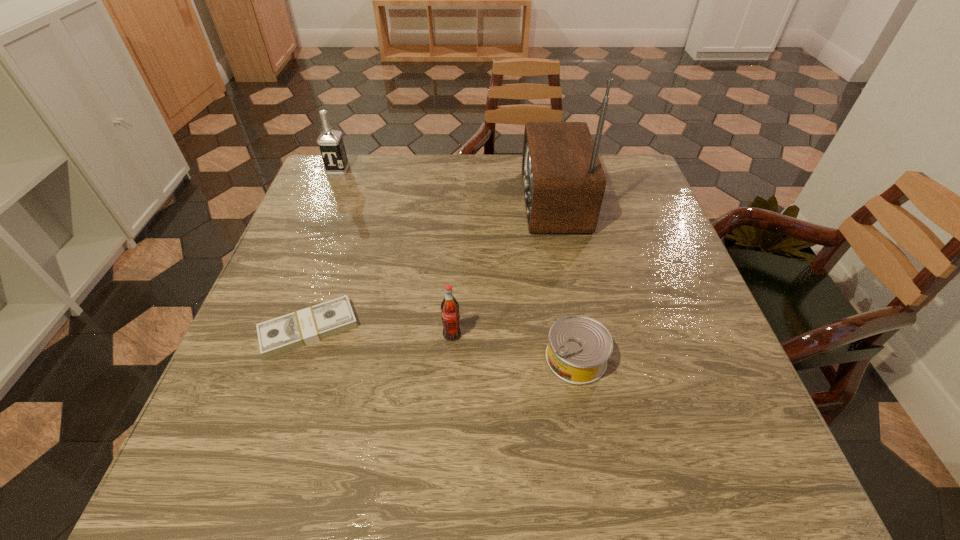
Locate an element on the screen. This screenshot has height=540, width=960. vacant area situated 0.090m on the label of the soda bottle is located at coordinates (449, 382).

Identify the location of free location located on the right of the second shortest object. Image resolution: width=960 pixels, height=540 pixels. (669, 358).

Find the location of a particular element. The image size is (960, 540). vacant space situated on the back of the shortest object is located at coordinates (345, 222).

Find the location of `radio receiver at the far edge`. radio receiver at the far edge is located at coordinates (563, 180).

This screenshot has height=540, width=960. I want to click on vodka that is at the far edge, so click(330, 141).

The width and height of the screenshot is (960, 540). What are the coordinates of `vodka that is positioned at the left edge` in the screenshot? It's located at (330, 141).

The width and height of the screenshot is (960, 540). In order to click on dollar present at the left edge in this screenshot , I will do `click(282, 334)`.

What are the coordinates of `object that is at the far left corner` in the screenshot? It's located at (330, 141).

In the image, there is a desktop. At what (x,y) coordinates should I click in order to perform the action: click on vacant space at the far edge. Please return your answer as a coordinate pair (x, y). Looking at the image, I should click on coord(396,160).

Where is `vacant space at the near edge`? The height and width of the screenshot is (540, 960). vacant space at the near edge is located at coordinates (659, 468).